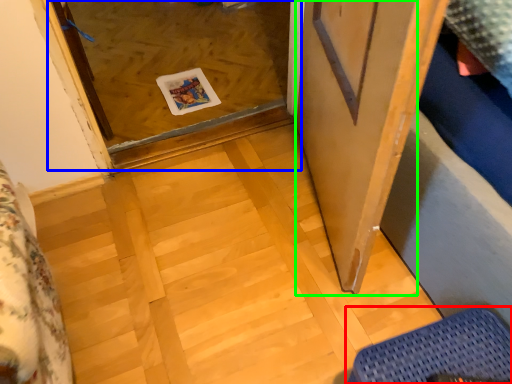
Question: Estimate the real-world distances between objects in this image. Which object is farther from furniture (highlighted by a red box), glass door (highlighted by a blue box) or screen door (highlighted by a green box)?

Choices:
 (A) glass door
 (B) screen door

Answer: (A)